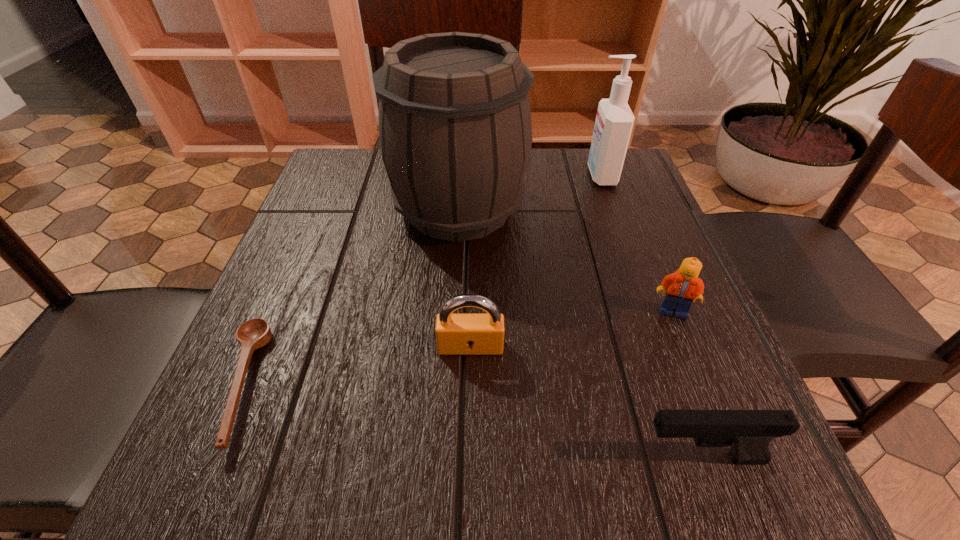
You are a GUI agent. You are given a task and a screenshot of the screen. Output one action in this format:
    pyautogui.click(x=<x>, y=<y>)
    Task: Click on the free space located 0.330m on the front label of the fifth shortest object
    Image resolution: width=960 pixels, height=540 pixels.
    Given the screenshot: What is the action you would take?
    pyautogui.click(x=446, y=176)

What are the coordinates of `free space located on the front-facing side of the Lego` in the screenshot? It's located at (686, 345).

I want to click on free space located to unlock the padlock from the front, so click(469, 430).

The image size is (960, 540). What are the coordinates of `free spot located on the front-facing side of the pistol` in the screenshot? It's located at (549, 457).

The height and width of the screenshot is (540, 960). In order to click on vacant space located 0.270m on the front-facing side of the pistol in this screenshot , I will do `click(425, 457)`.

Image resolution: width=960 pixels, height=540 pixels. What are the coordinates of `free space located on the front-facing side of the pistol` in the screenshot? It's located at (526, 457).

The width and height of the screenshot is (960, 540). In order to click on vacant space located on the right of the leftmost object in this screenshot , I will do `click(385, 383)`.

At what (x,y) coordinates should I click in order to perform the action: click on wine bucket at the far edge. Please return your answer as a coordinate pair (x, y). Looking at the image, I should click on (455, 132).

Locate an element on the screen. cleansing agent that is at the far edge is located at coordinates (614, 121).

Where is `pistol situated at the near edge`? pistol situated at the near edge is located at coordinates (749, 433).